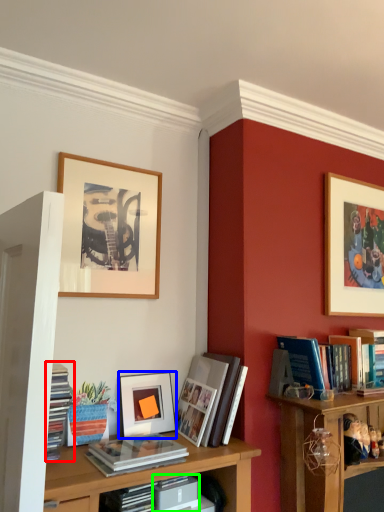
Question: Considering the real-world distances, which object is closest to book (highlighted by a red box)? picture frame (highlighted by a blue box) or paperback book (highlighted by a green box).

Choices:
 (A) picture frame
 (B) paperback book

Answer: (A)